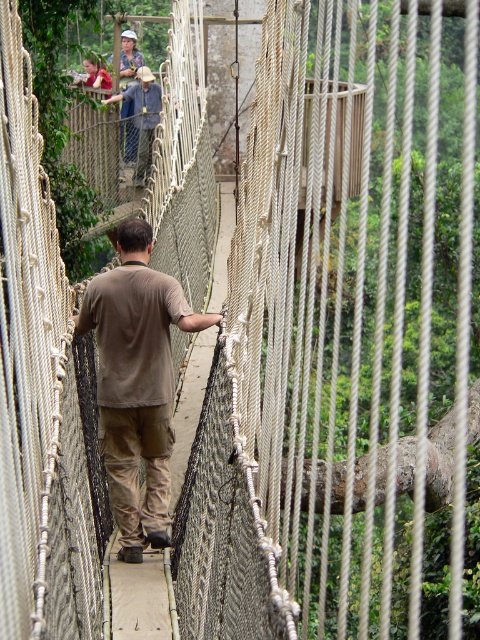
Question: Among these points, which one is nearest to the camera?

Choices:
 (A) (105, 70)
 (B) (129, 115)
 (C) (140, 179)

Answer: (C)

Question: Is denim jacket at upper center smaller than camouflage shirt at upper center?

Choices:
 (A) yes
 (B) no

Answer: (A)

Question: Is brown cotton shirt at center below camouflage shirt at upper center?

Choices:
 (A) no
 (B) yes

Answer: (B)

Question: In this image, where is brown cotton shirt at center located relative to matte khaki shirt at upper center?

Choices:
 (A) below
 (B) above

Answer: (A)

Question: Estimate the real-world distances between objects in this image. Which object is farther from the brown cotton shirt at center?

Choices:
 (A) matte khaki shirt at upper center
 (B) camouflage shirt at upper center

Answer: (B)

Question: Which is nearer to the camouflage shirt at upper center?

Choices:
 (A) brown cotton shirt at center
 (B) matte khaki shirt at upper center
 (C) denim jacket at upper center

Answer: (C)